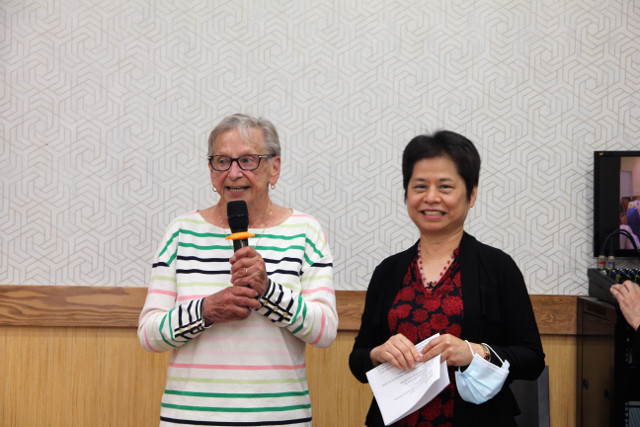
The height and width of the screenshot is (427, 640). Find the location of `white and grey wall`. white and grey wall is located at coordinates (128, 95).